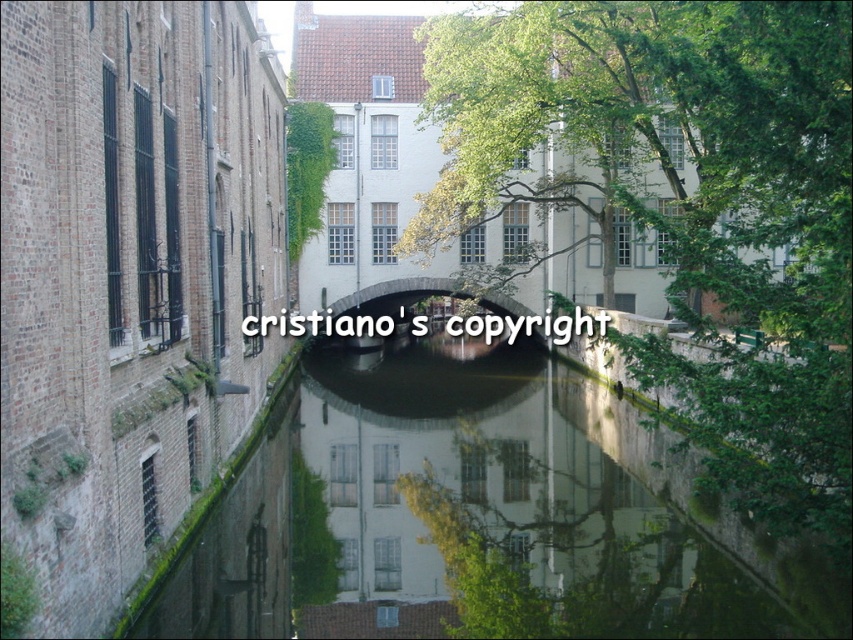
You are standing at the point with coordinates point (526, 72) and want to walk to the point with coordinates point (456, 348). Which direction should you move in to reach your destination?

To reach point (456, 348) from point (526, 72), you should move towards the right and slightly forward since point (456, 348) is behind point (526, 72).

You are standing on the canal bridge and see two points marked in the scene. Which point is closer to you? The points are point (454, 540) and point (498, 296).

Point (454, 540) is closer to the viewer than point (498, 296).